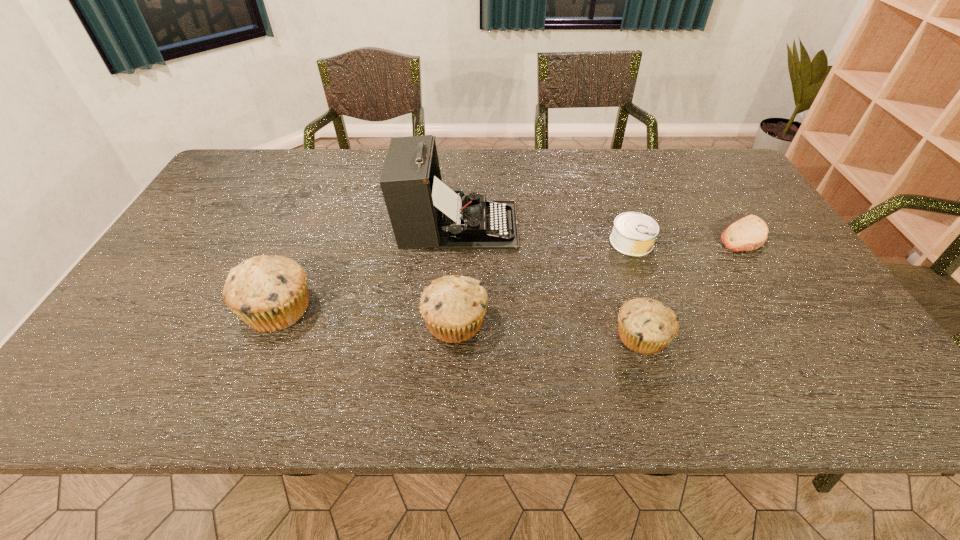
Locate an element on the screen. object that can be found as the fourth closest to the second shortest object is located at coordinates (453, 306).

This screenshot has width=960, height=540. Find the location of `the third closest object relative to the second tallest muffin`. the third closest object relative to the second tallest muffin is located at coordinates (646, 326).

Choose which muffin is the second nearest neighbor to the can. Please provide its 2D coordinates. Your answer should be formatted as a tuple, i.e. [(x, y)], where the tuple contains the x and y coordinates of a point satisfying the conditions above.

[(453, 306)]

At what (x,y) coordinates should I click in order to perform the action: click on muffin that is the closest one to the typewriter. Please return your answer as a coordinate pair (x, y). Looking at the image, I should click on (453, 306).

At what (x,y) coordinates should I click in order to perform the action: click on vacant space that satisfies the following two spatial constraints: 1. on the front side of the fourth shortest object; 2. on the left side of the fourth tallest object. Please return your answer as a coordinate pair (x, y). The width and height of the screenshot is (960, 540). Looking at the image, I should click on (454, 336).

In order to click on free spot that satisfies the following two spatial constraints: 1. inside the open case of the tallest object; 2. on the right side of the rightmost object in this screenshot , I will do `click(457, 235)`.

Where is `free space that satisfies the following two spatial constraints: 1. inside the open case of the pita bread; 2. on the right side of the typewriter`? free space that satisfies the following two spatial constraints: 1. inside the open case of the pita bread; 2. on the right side of the typewriter is located at coordinates (457, 235).

Where is `vacant area that satisfies the following two spatial constraints: 1. inside the open case of the fifth tallest object; 2. on the right side of the tallest object`? Image resolution: width=960 pixels, height=540 pixels. vacant area that satisfies the following two spatial constraints: 1. inside the open case of the fifth tallest object; 2. on the right side of the tallest object is located at coordinates coord(457,242).